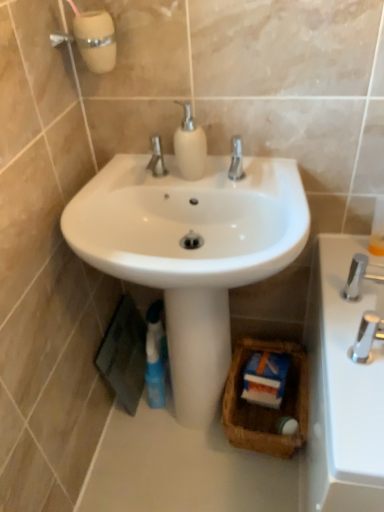
Find the location of `vacant space positioned to the left of white matte soap dispenser at center`. vacant space positioned to the left of white matte soap dispenser at center is located at coordinates (x=142, y=185).